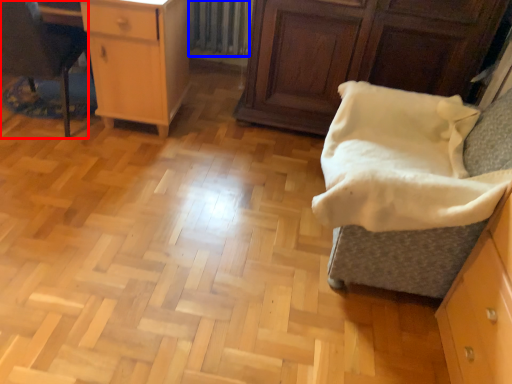
Question: Which object appears farthest to the camera in this image, furniture (highlighted by a red box) or radiator (highlighted by a blue box)?

Choices:
 (A) furniture
 (B) radiator

Answer: (B)